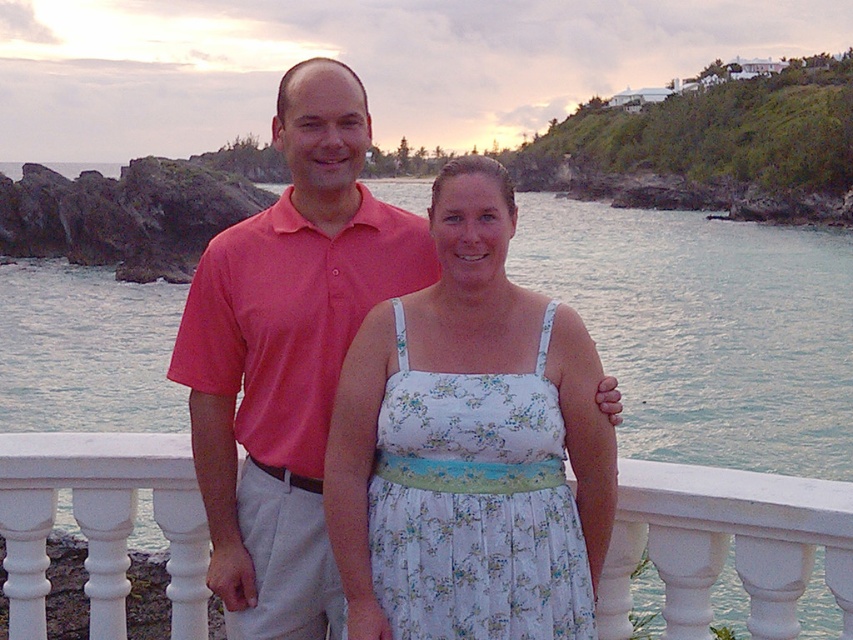
Question: Is clear water at center wider than floral cotton dress at center?

Choices:
 (A) no
 (B) yes

Answer: (B)

Question: Estimate the real-world distances between objects in this image. Which object is closer to the white plastic railing at center?

Choices:
 (A) pink cotton shirt at upper left
 (B) floral cotton dress at center
 (C) clear water at center

Answer: (B)

Question: Is clear water at center bigger than floral cotton dress at center?

Choices:
 (A) yes
 (B) no

Answer: (A)

Question: Among these points, which one is nearest to the camera?

Choices:
 (A) (693, 627)
 (B) (547, 193)
 (C) (453, 433)

Answer: (C)

Question: Considering the relative positions of pink cotton shirt at upper left and floral cotton dress at center in the image provided, where is pink cotton shirt at upper left located with respect to floral cotton dress at center?

Choices:
 (A) below
 (B) above

Answer: (B)

Question: Which object is the closest to the pink cotton shirt at upper left?

Choices:
 (A) floral cotton dress at center
 (B) clear water at center
 (C) white plastic railing at center

Answer: (A)